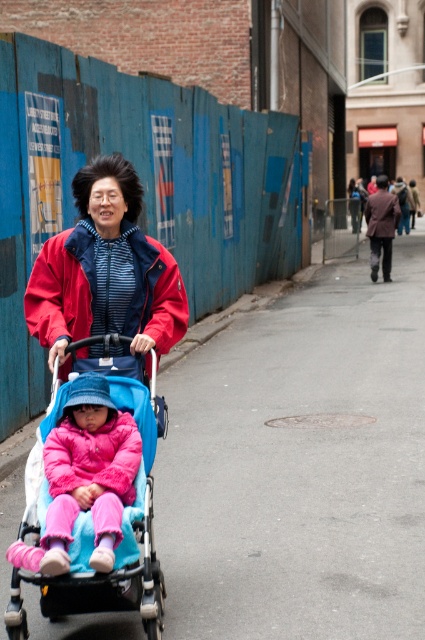
Question: Does blue fabric stroller at center appear over matte red jacket at center?

Choices:
 (A) no
 (B) yes

Answer: (A)

Question: Can you confirm if blue fabric stroller at center is positioned to the right of matte red jacket at center?

Choices:
 (A) no
 (B) yes

Answer: (B)

Question: Which of the following is the farthest from the observer?

Choices:
 (A) (99, 596)
 (B) (178, 305)

Answer: (B)

Question: Which point appears farthest from the camera in this image?

Choices:
 (A) (130, 588)
 (B) (28, 321)

Answer: (B)

Question: Does blue fabric stroller at center have a lesser width compared to matte red jacket at center?

Choices:
 (A) yes
 (B) no

Answer: (A)